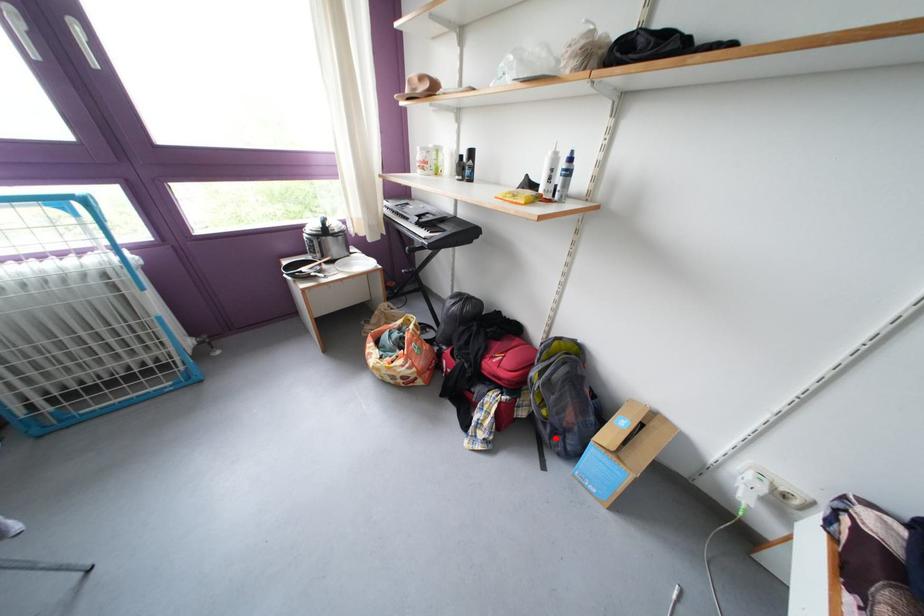
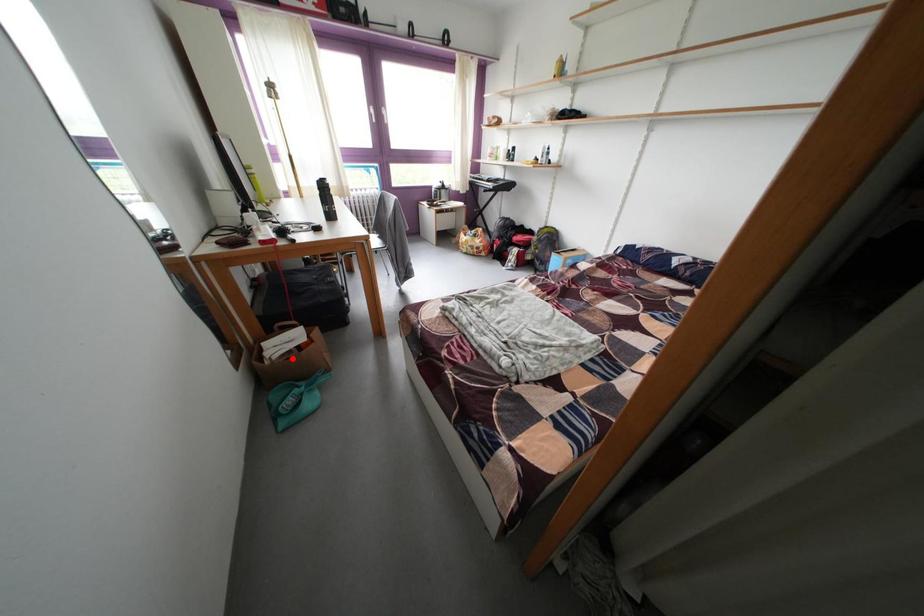
I am providing you with two images of the same scene from different viewpoints. A red point is marked on the first image and another point is marked on the second image. Do the highlighted points in image1 and image2 indicate the same real-world spot?

No